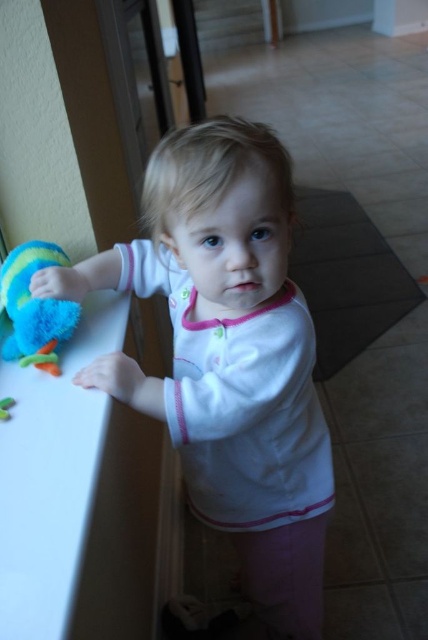
Question: Among these objects, which one is farthest from the camera?

Choices:
 (A) soft plush toy at left
 (B) white soft shirt at center

Answer: (A)

Question: Which object is closer to the camera taking this photo?

Choices:
 (A) soft plush toy at left
 (B) white soft shirt at center

Answer: (B)

Question: Is white soft shirt at center smaller than soft plush toy at left?

Choices:
 (A) yes
 (B) no

Answer: (B)

Question: Can you confirm if white soft shirt at center is thinner than soft plush toy at left?

Choices:
 (A) no
 (B) yes

Answer: (A)

Question: Which of the following is the closest to the observer?

Choices:
 (A) (329, 500)
 (B) (45, 321)

Answer: (B)

Question: Can you confirm if white soft shirt at center is smaller than soft plush toy at left?

Choices:
 (A) no
 (B) yes

Answer: (A)